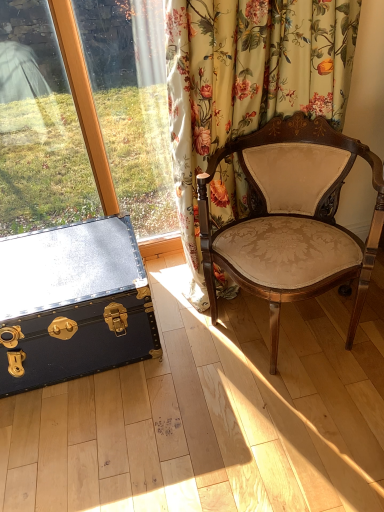
Image resolution: width=384 pixels, height=512 pixels. Find the location of `vacant area that is in front of velvet beige chair at center`. vacant area that is in front of velvet beige chair at center is located at coordinates click(284, 431).